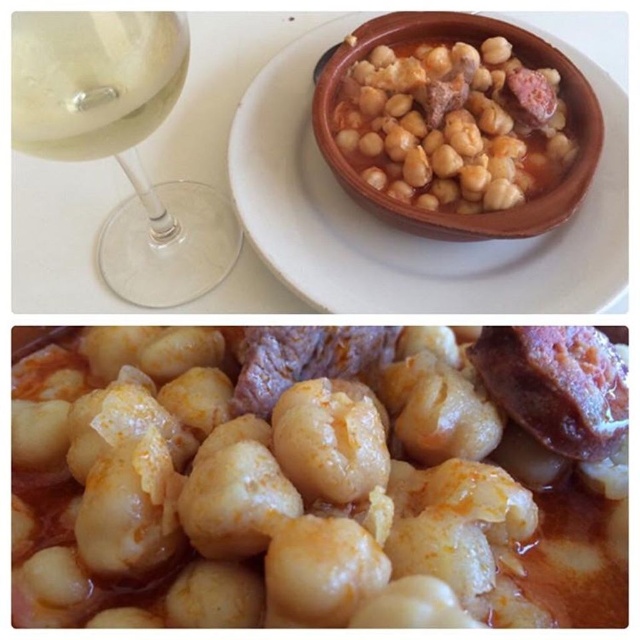
You are at a dinner table with the transparent glass wine at upper left and the terracotta bowl at upper center in front of you. If you want to pour more wine into the glass without spilling, which object should you move first and why?

You should move the transparent glass wine at upper left first because it has a lesser height compared to the terracotta bowl at upper center, making it easier to access and pour without knocking over the taller bowl.

You are a food delivery robot with a 10 inch wide tray. You need to place the glossy white gnocchi at center and the terracotta bowl at upper center onto your tray. Can you fit both items on your tray without overlapping?

The distance between the glossy white gnocchi at center and the terracotta bowl at upper center is 9.42 inches. Since your tray is 10 inches wide, you can fit both items on the tray without overlapping as the required space is less than the tray width.